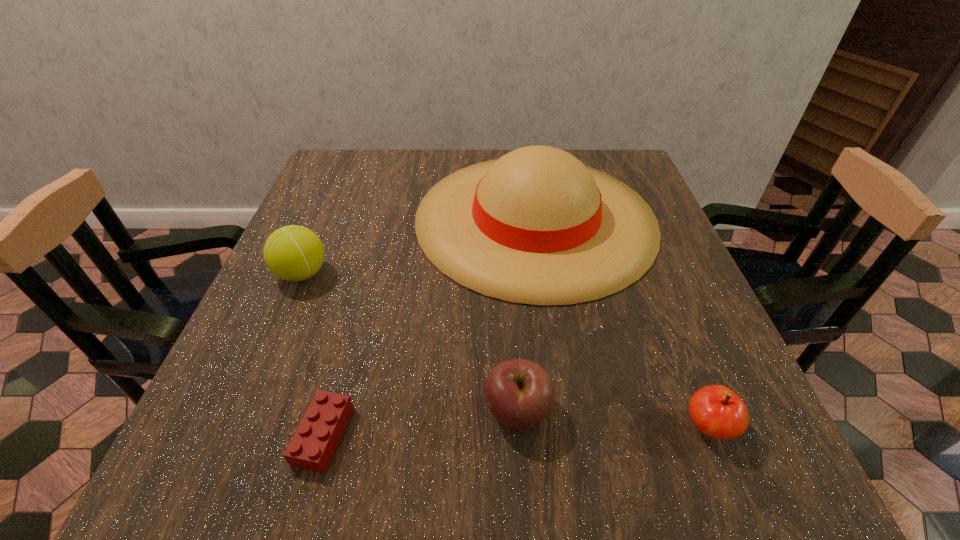
The image size is (960, 540). In order to click on the tallest object in this screenshot , I will do `click(536, 226)`.

At what (x,y) coordinates should I click in order to perform the action: click on the second tallest object. Please return your answer as a coordinate pair (x, y). The image size is (960, 540). Looking at the image, I should click on (294, 253).

You are a GUI agent. You are given a task and a screenshot of the screen. Output one action in this format:
    pyautogui.click(x=<x>, y=<y>)
    Task: Click on the leftmost object
    The width and height of the screenshot is (960, 540).
    Given the screenshot: What is the action you would take?
    pyautogui.click(x=294, y=253)

The image size is (960, 540). Identify the location of the left apple. (519, 393).

Locate an element on the screen. The height and width of the screenshot is (540, 960). the right apple is located at coordinates (718, 412).

Where is `Lego`? The image size is (960, 540). Lego is located at coordinates (311, 448).

What are the coordinates of `the shortest object` in the screenshot? It's located at (311, 448).

Identify the location of vacant space situated on the front of the sombrero. [x=564, y=403].

Identify the location of vacant space situated on the back of the tennis ball. The width and height of the screenshot is (960, 540). (348, 166).

Identify the location of vacant space located 0.080m on the side of the left apple with the unique marking. (434, 411).